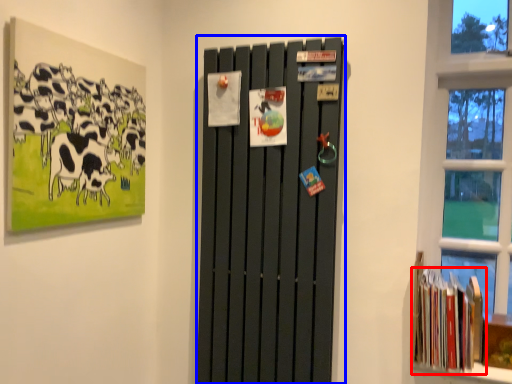
Question: Among these objects, which one is farthest to the camera, book (highlighted by a red box) or barn door (highlighted by a blue box)?

Choices:
 (A) book
 (B) barn door

Answer: (A)